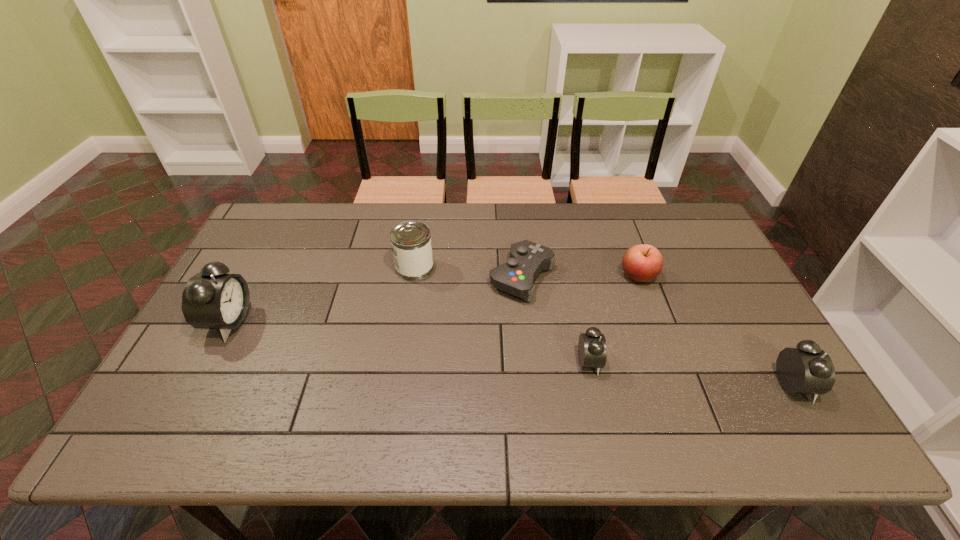
If equal spacing is desired by inserting an extra alarm_clock among them, please point out a free spot for this new alarm_clock. Please provide its 2D coordinates. Your answer should be formatted as a tuple, i.e. [(x, y)], where the tuple contains the x and y coordinates of a point satisfying the conditions above.

[(402, 341)]